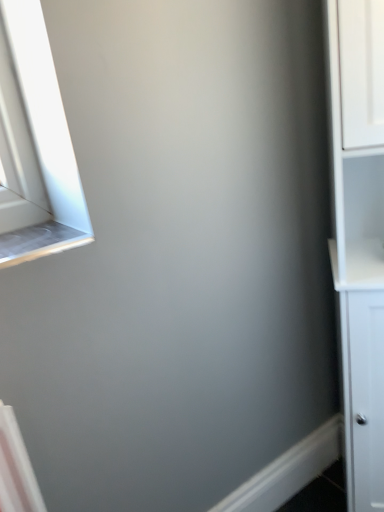
Where is `white glossy cabinet at right`? The height and width of the screenshot is (512, 384). white glossy cabinet at right is located at coordinates (359, 236).

Measure the distance between white glossy cabinet at right and camera.

white glossy cabinet at right is 71.50 centimeters from camera.

What do you see at coordinates (359, 236) in the screenshot? I see `white glossy cabinet at right` at bounding box center [359, 236].

In order to face white glossy cabinet at right, should I rotate leftwards or rightwards?

It's best to rotate right around 21.312 degrees.

Where is `white glossy cabinet at right`? The image size is (384, 512). white glossy cabinet at right is located at coordinates (359, 236).